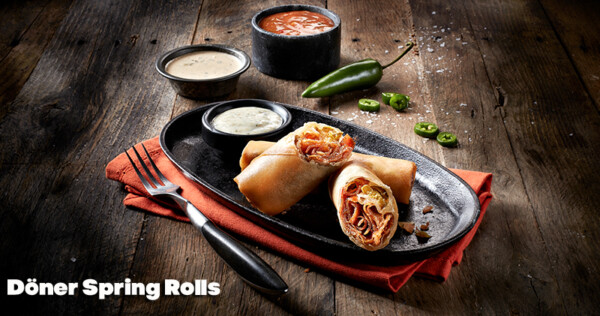
In order to click on plate in this screenshot , I will do `click(447, 230)`.